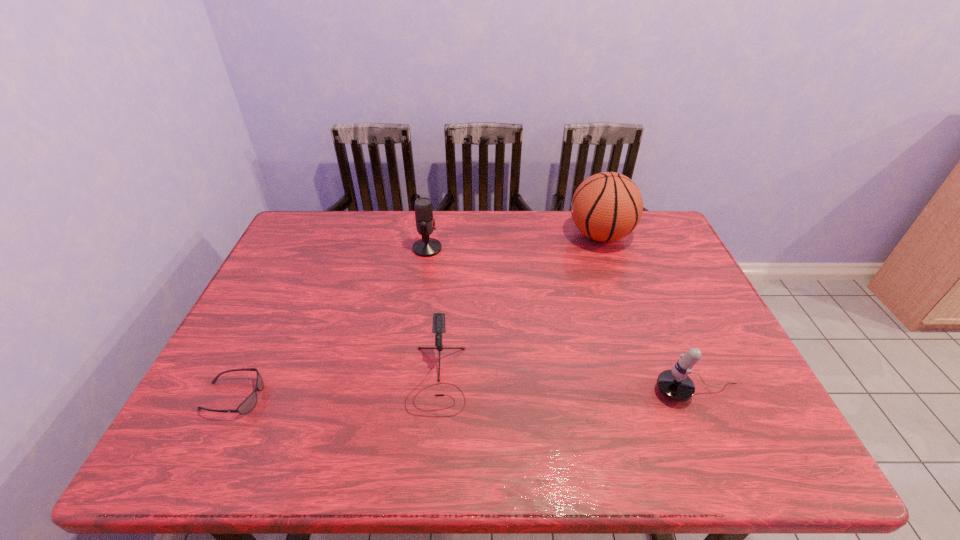
Locate which microphone ranks second in proximity to the rightmost microphone. Please provide its 2D coordinates. Your answer should be formatted as a tuple, i.e. [(x, y)], where the tuple contains the x and y coordinates of a point satisfying the conditions above.

[(426, 247)]

Locate an element on the screen. Image resolution: width=960 pixels, height=540 pixels. free space in the image that satisfies the following two spatial constraints: 1. on the side where the inflation valve is located; 2. on the right side of the third shortest object is located at coordinates (656, 392).

The height and width of the screenshot is (540, 960). I want to click on blank space that satisfies the following two spatial constraints: 1. on the side where the inflation valve is located; 2. on the stand of the fourth tallest object, so click(x=651, y=379).

Identify the location of free spot that satisfies the following two spatial constraints: 1. on the side of the farthest microphone with the red ring; 2. on the back side of the second shortest microphone. The height and width of the screenshot is (540, 960). (406, 392).

At what (x,y) coordinates should I click in order to perform the action: click on free point that satisfies the following two spatial constraints: 1. on the side where the inflation valve is located; 2. on the left side of the second shortest microphone. Please return your answer as a coordinate pair (x, y). The width and height of the screenshot is (960, 540). Looking at the image, I should click on (656, 392).

Where is `vacant space that satisfies the following two spatial constraints: 1. on the side of the farthest microphone with the red ring; 2. on the right side of the third shortest object`? The width and height of the screenshot is (960, 540). vacant space that satisfies the following two spatial constraints: 1. on the side of the farthest microphone with the red ring; 2. on the right side of the third shortest object is located at coordinates (406, 392).

Locate an element on the screen. The height and width of the screenshot is (540, 960). vacant space that satisfies the following two spatial constraints: 1. on the side of the fourth shortest object with the red ring; 2. on the back side of the third shortest object is located at coordinates (406, 392).

This screenshot has height=540, width=960. I want to click on vacant space that satisfies the following two spatial constraints: 1. on the side where the inflation valve is located; 2. on the left side of the third shortest object, so click(x=656, y=392).

Identify the location of vacant space that satisfies the following two spatial constraints: 1. on the stand of the shortest microphone; 2. on the lenses of the sunglasses. 436,397.